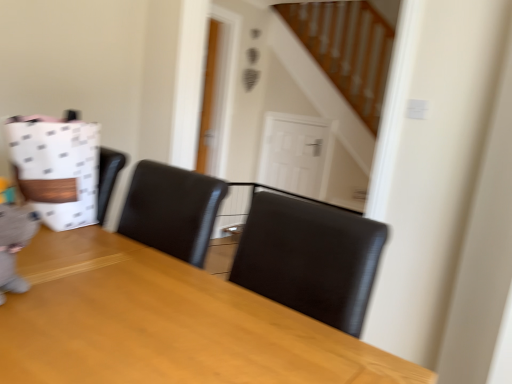
Question: Considering their positions, is wooden table at center located in front of or behind white dotted paper bag at left?

Choices:
 (A) behind
 (B) front

Answer: (B)

Question: Visually, is wooden table at center positioned to the left or to the right of white dotted paper bag at left?

Choices:
 (A) left
 (B) right

Answer: (B)

Question: Which object is the farthest from the wooden table at center?

Choices:
 (A) white glossy door at center
 (B) white dotted paper bag at left

Answer: (A)

Question: Based on their relative distances, which object is nearer to the wooden table at center?

Choices:
 (A) white glossy door at center
 (B) white dotted paper bag at left

Answer: (B)